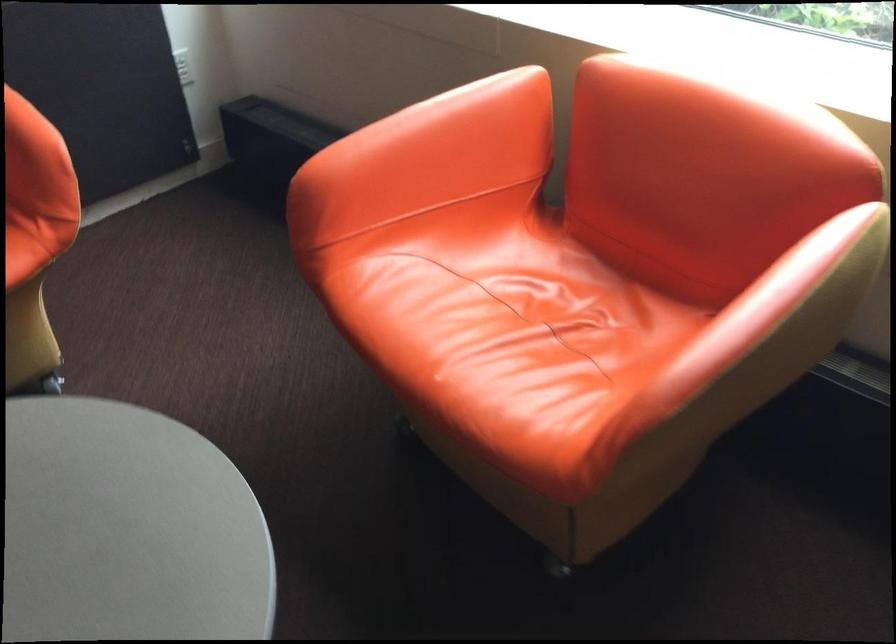
Find where to sit the chair sitting surface. Please return your answer as a coordinate pair (x, y).

(519, 277)